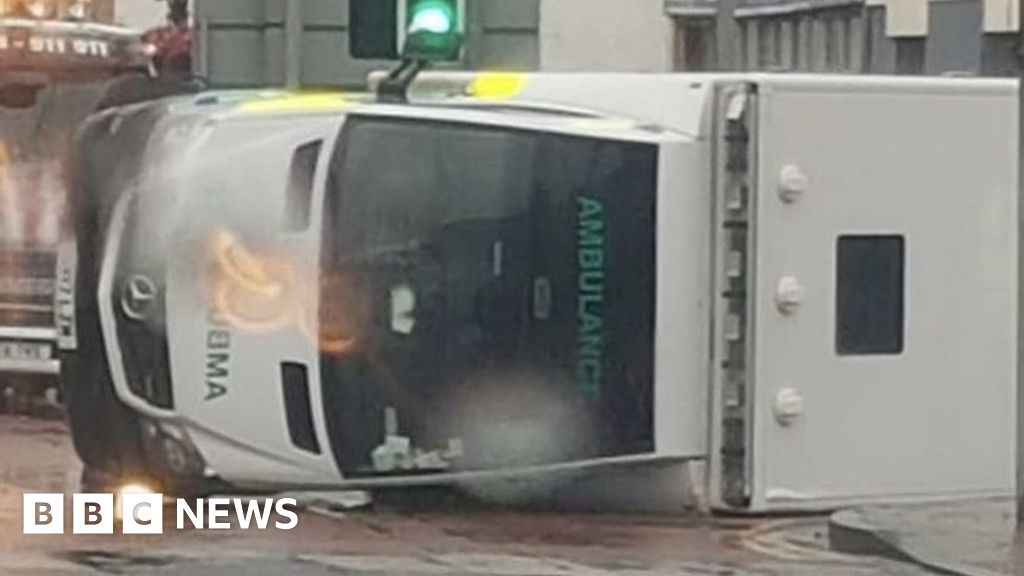
Identify the location of gray wall. This screenshot has width=1024, height=576. (309, 50).